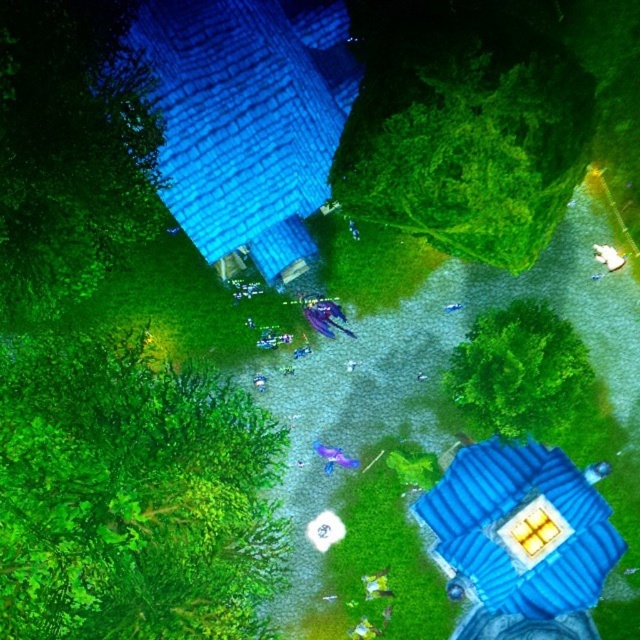
You are navigating a character in this game scene. You need to move from your current position to the point marked as point (544, 416). There is an obstacle at point (4, 195). Will you encounter this obstacle before reaching your destination?

Yes, you will encounter the obstacle at point (4, 195) before reaching point (544, 416) because point (4, 195) is in front of point (544, 416).

You are a character in the game and want to plant a new tree. The game requires you to choose a spot that is not occupied by any existing objects. Based on the scene, is the point at coordinates point (467, 141) suitable for planting a new tree?

The point at coordinates point (467, 141) is occupied by a green leafy tree at upper center, so it is not suitable for planting a new tree.